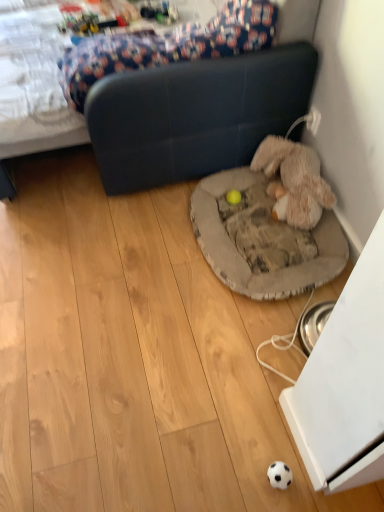
Find the location of a particular element. Image resolution: width=384 pixels, height=512 pixels. free space to the left of gray fabric dog bed at center is located at coordinates (132, 248).